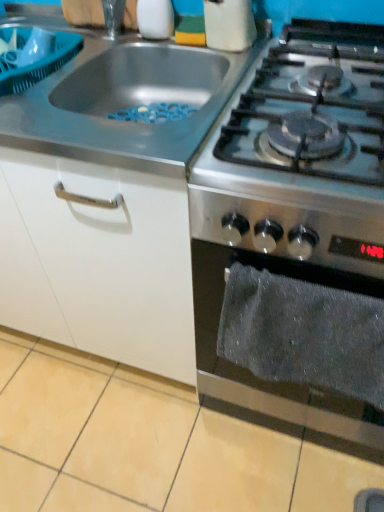
Where is `vacant region to the left of white glossy salt shaker at upper center`? The image size is (384, 512). vacant region to the left of white glossy salt shaker at upper center is located at coordinates coord(97,50).